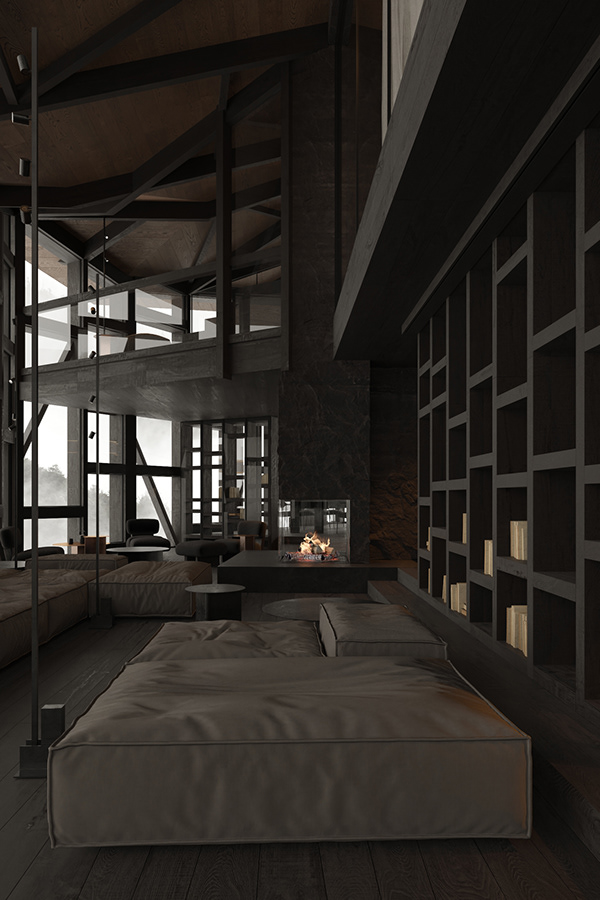
Identify the location of tall thin lamps. (35, 300), (97, 520), (105, 241).